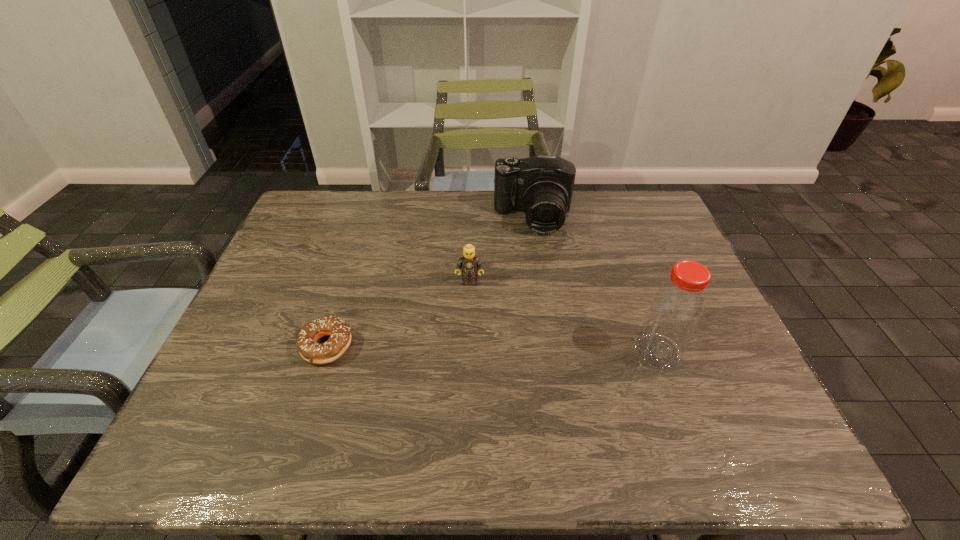
I want to click on doughnut, so click(x=340, y=332).

Where is `the shortest object`? the shortest object is located at coordinates (340, 332).

Where is `bottle`? This screenshot has height=540, width=960. bottle is located at coordinates (675, 311).

Find the location of a particular element. This screenshot has height=540, width=960. the tallest object is located at coordinates (675, 311).

I want to click on the farthest object, so click(541, 186).

The image size is (960, 540). I want to click on the second object from right to left, so click(541, 186).

In order to click on the third tallest object in this screenshot , I will do `click(469, 263)`.

This screenshot has width=960, height=540. I want to click on the third object from right to left, so click(x=469, y=263).

You are a GUI agent. You are given a task and a screenshot of the screen. Output one action in this format:
    pyautogui.click(x=<x>, y=<y>)
    Task: Click on the vacant space situated on the right of the shortest object
    
    Given the screenshot: What is the action you would take?
    pyautogui.click(x=373, y=347)

This screenshot has width=960, height=540. Identify the location of vacant space located 0.080m on the left of the rightmost object. (601, 352).